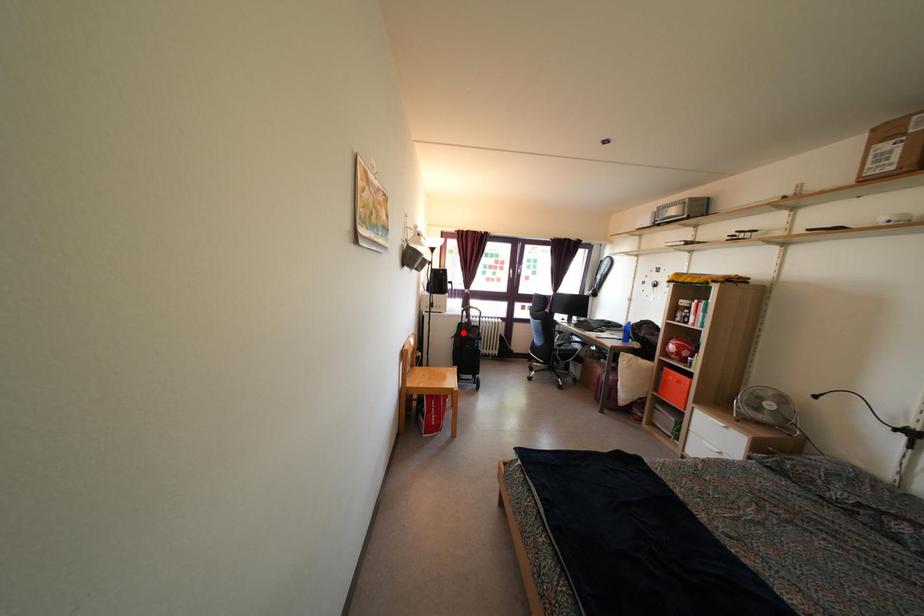
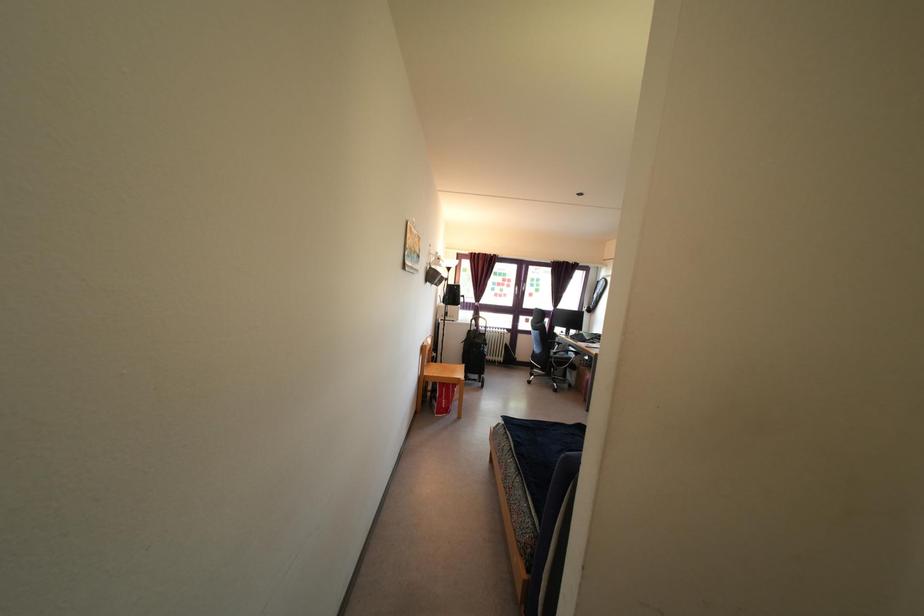
Find the pixel in the second image that matches the highlighted location in the first image.

(472, 339)